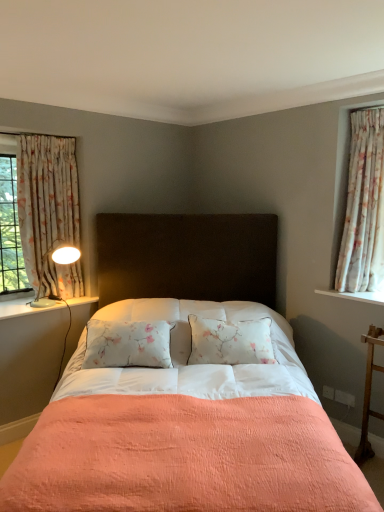
Where is `vacant region above floral fabric curtain at left, which appears as the 1th curtain when viewed from the left (from a real-world perspective)`? vacant region above floral fabric curtain at left, which appears as the 1th curtain when viewed from the left (from a real-world perspective) is located at coordinates (50, 134).